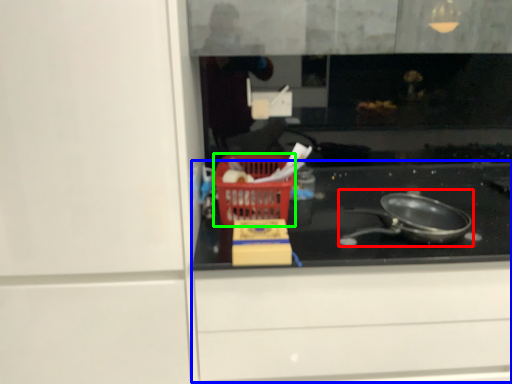
Question: Considering the real-world distances, which object is farthest from frying pan (highlighted by a red box)? cabinetry (highlighted by a blue box) or basket (highlighted by a green box)?

Choices:
 (A) cabinetry
 (B) basket

Answer: (B)